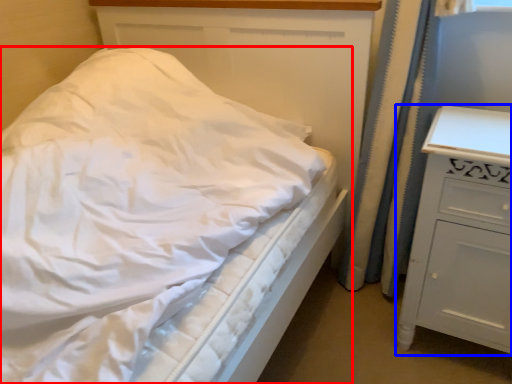
Question: Among these objects, which one is farthest to the camera, bed (highlighted by a red box) or chest of drawers (highlighted by a blue box)?

Choices:
 (A) bed
 (B) chest of drawers

Answer: (B)